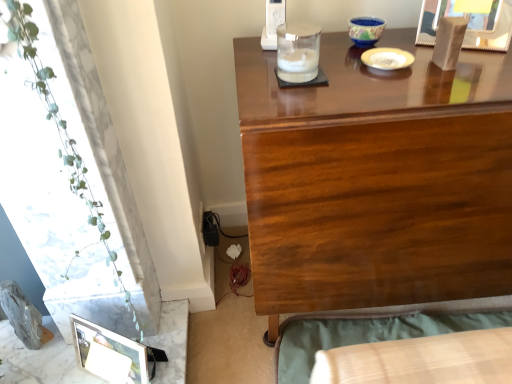
Find the location of a particular element. free space in front of white glossy plate at upper center is located at coordinates (405, 86).